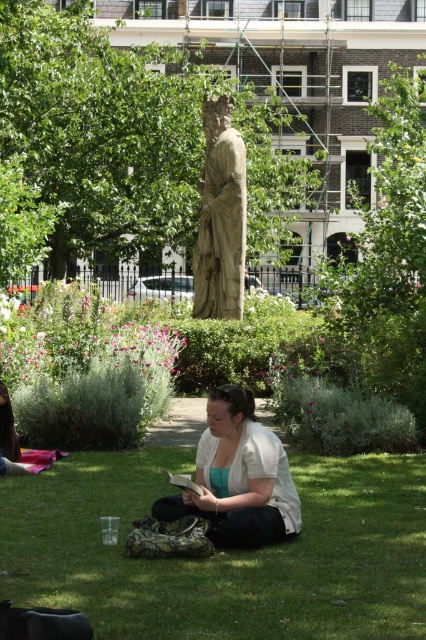
Is point (385, 461) in front of point (195, 250)?

Yes, it is.

Is green grass at center bigger than stone statue at center?

No.

Which is in front, point (348, 472) or point (207, 193)?

Positioned in front is point (348, 472).

Where is `green grass at center`? This screenshot has width=426, height=640. green grass at center is located at coordinates (222, 552).

What do you see at coordinates (222, 552) in the screenshot? I see `green grass at center` at bounding box center [222, 552].

Between green grass at center and white cotton shirt at center, which one appears on the left side from the viewer's perspective?

Positioned to the left is white cotton shirt at center.

Identify the location of green grass at center. (222, 552).

Is point (236, 518) positioned before point (207, 291)?

Yes.

Between white cotton shirt at center and stone statue at center, which one appears on the right side from the viewer's perspective?

white cotton shirt at center

Does point (198, 502) come behind point (203, 173)?

That is False.

Locate an element on the screen. The height and width of the screenshot is (640, 426). white cotton shirt at center is located at coordinates (238, 477).